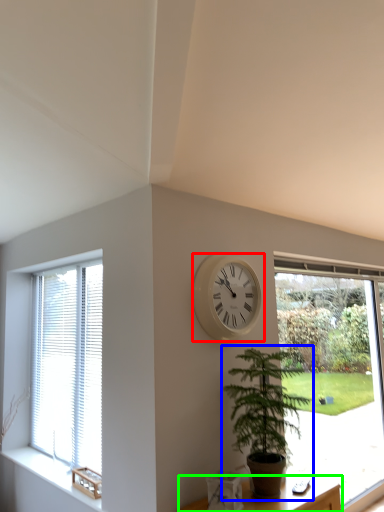
Question: Which object is positioned farthest from wall clock (highlighted by a red box)? Select from houseplant (highlighted by a blue box) and furniture (highlighted by a green box).

Choices:
 (A) houseplant
 (B) furniture

Answer: (B)